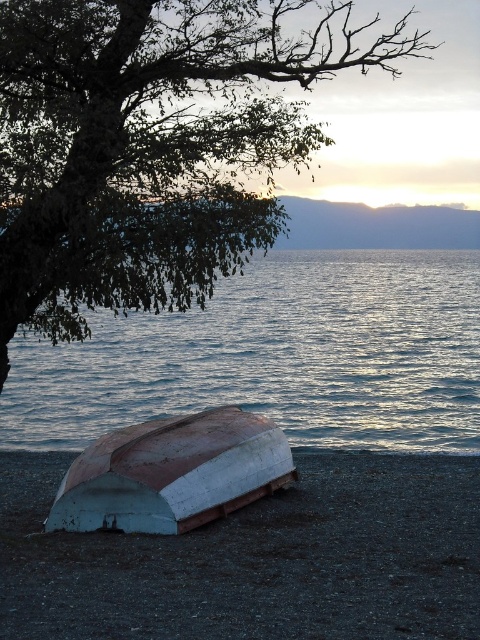
Question: Can you confirm if white painted wood boat at lower center is positioned to the right of white matte boat at lower left?

Choices:
 (A) no
 (B) yes

Answer: (B)

Question: Among these objects, which one is farthest from the camera?

Choices:
 (A) white matte boat at lower left
 (B) white painted wood boat at lower center
 (C) blue water at center
 (D) green leafy tree at upper left

Answer: (C)

Question: Which object is the farthest from the blue water at center?

Choices:
 (A) white painted wood boat at lower center
 (B) white matte boat at lower left

Answer: (A)

Question: Does green leafy tree at upper left appear under white matte boat at lower left?

Choices:
 (A) no
 (B) yes

Answer: (A)

Question: Can you confirm if green leafy tree at upper left is thinner than white matte boat at lower left?

Choices:
 (A) yes
 (B) no

Answer: (B)

Question: Based on their relative distances, which object is nearer to the blue water at center?

Choices:
 (A) green leafy tree at upper left
 (B) white matte boat at lower left
 (C) white painted wood boat at lower center

Answer: (A)